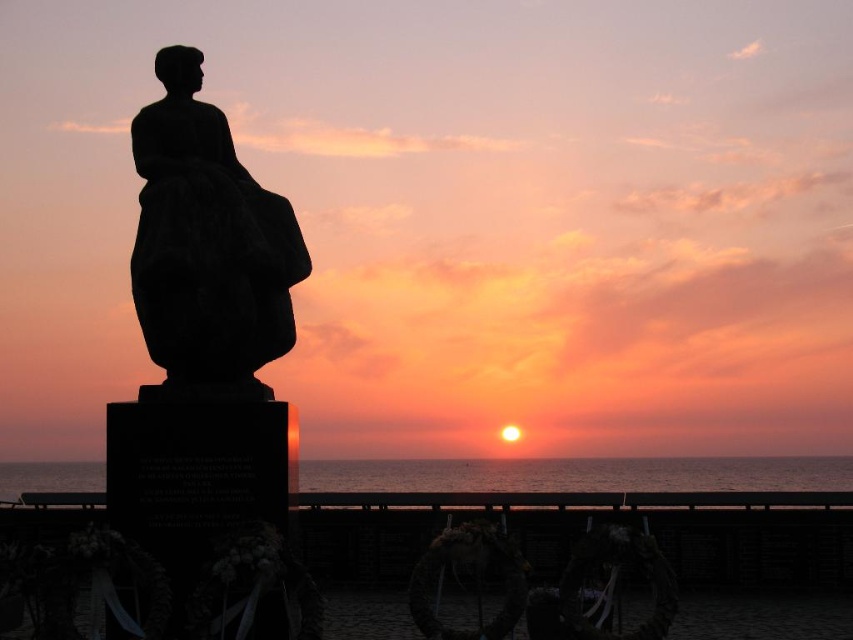
Who is more distant from viewer, (225, 349) or (755, 483)?

Point (755, 483)

Which is more to the right, black stone statue at left or smooth ocean water at center?

smooth ocean water at center

Is point (171, 248) closer to viewer compared to point (25, 467)?

Yes, it is in front of point (25, 467).

Find the location of a particular element. The height and width of the screenshot is (640, 853). black stone statue at left is located at coordinates (207, 244).